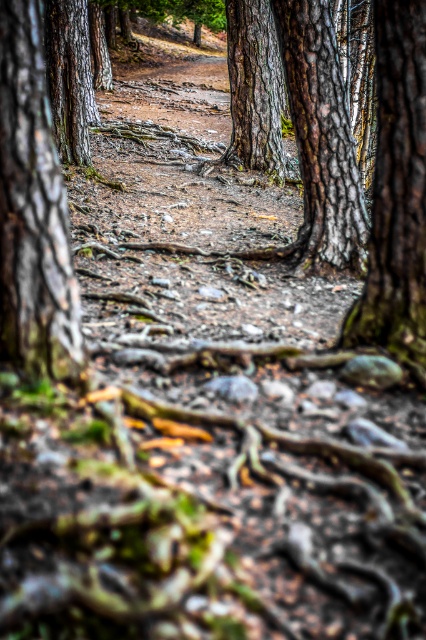
You are standing on the dirt path in the forest scene. You see two points marked on the ground. The first point is at coordinates point (40, 184) and the second point is at point (275, 60). Which point is closer to you?

Point (40, 184) is closer to the viewer than point (275, 60).